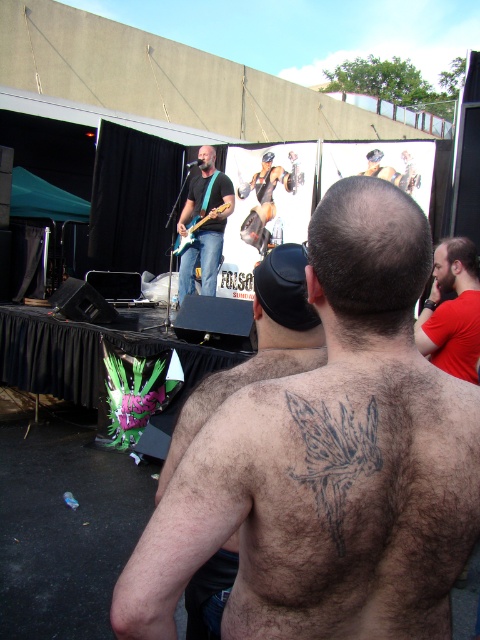
You are a photographer at the event and want to capture a photo of the hairy skin tattoo at back and the red matte shirt at upper right. Which object is positioned closer to the camera?

The hairy skin tattoo at back is closer to the viewer than the red matte shirt at upper right, so the tattoo would appear closer to the camera in the photo.

You are a photographer at the event and want to capture a closeup of the tattoos on the audience member. Which tattoo, the hairy skin tattoo at center or the black ink tattoo at back, should you focus on if you want to highlight its size?

The hairy skin tattoo at center is larger in size than the black ink tattoo at back, so you should focus on the hairy skin tattoo at center to highlight its size.